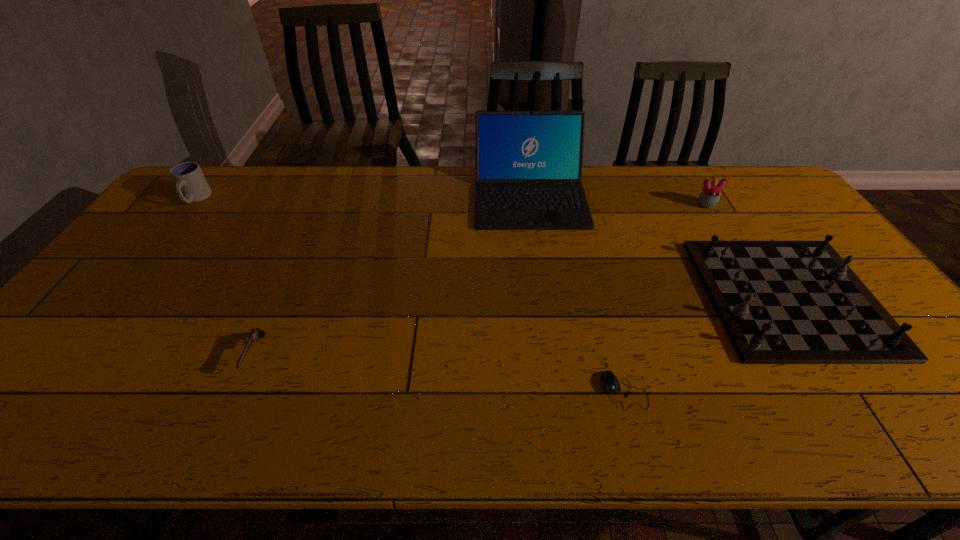
I want to click on vacant area between the second shortest object and the chessboard, so click(x=522, y=326).

Where is `empty space that is in between the second shortest object and the leftmost object`? The image size is (960, 540). empty space that is in between the second shortest object and the leftmost object is located at coordinates (226, 277).

Where is `vacant space in between the tallest object and the computer mouse`? The height and width of the screenshot is (540, 960). vacant space in between the tallest object and the computer mouse is located at coordinates (578, 293).

You are a GUI agent. You are given a task and a screenshot of the screen. Output one action in this format:
    pyautogui.click(x=<x>, y=<y>)
    Task: Click on the free area in between the cupcake and the computer mouse
    This screenshot has height=540, width=960.
    Given the screenshot: What is the action you would take?
    pyautogui.click(x=665, y=298)

Image resolution: width=960 pixels, height=540 pixels. What are the coordinates of `vacant space that is in between the chessboard and the computer mouse` in the screenshot? It's located at (707, 344).

Identify which object is the fourth closest to the leftmost object. Please provide its 2D coordinates. Your answer should be formatted as a tuple, i.e. [(x, y)], where the tuple contains the x and y coordinates of a point satisfying the conditions above.

[(781, 302)]

Select which object is the closest to the shortest object. Please provide its 2D coordinates. Your answer should be formatted as a tuple, i.e. [(x, y)], where the tuple contains the x and y coordinates of a point satisfying the conditions above.

[(781, 302)]

You are a GUI agent. You are given a task and a screenshot of the screen. Output one action in this format:
    pyautogui.click(x=<x>, y=<y>)
    Task: Click on the free space in the image that satisfies the following two spatial constraints: 1. on the screen of the tallest object; 2. on the right side of the computer mouse
    
    Given the screenshot: What is the action you would take?
    pyautogui.click(x=557, y=390)